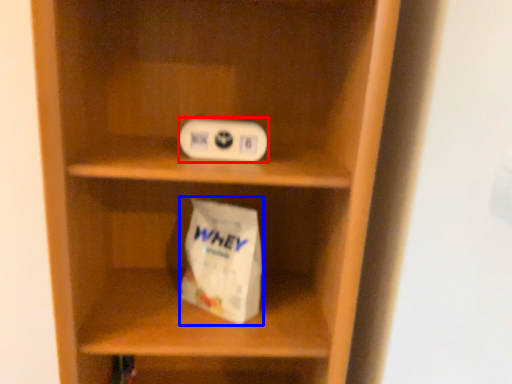
Question: Which object appears farthest to the camera in this image, ipod (highlighted by a red box) or paper bag (highlighted by a blue box)?

Choices:
 (A) ipod
 (B) paper bag

Answer: (B)